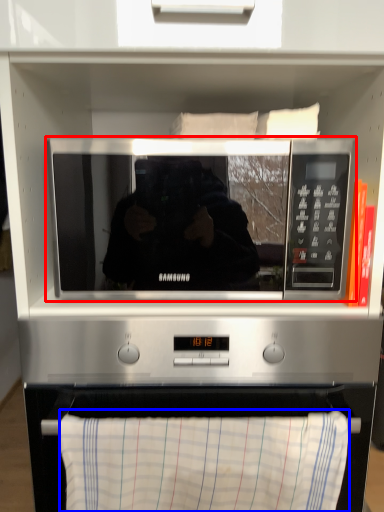
Question: Which point is further to the camera, microwave oven (highlighted by a red box) or cloth (highlighted by a blue box)?

Choices:
 (A) microwave oven
 (B) cloth

Answer: (A)